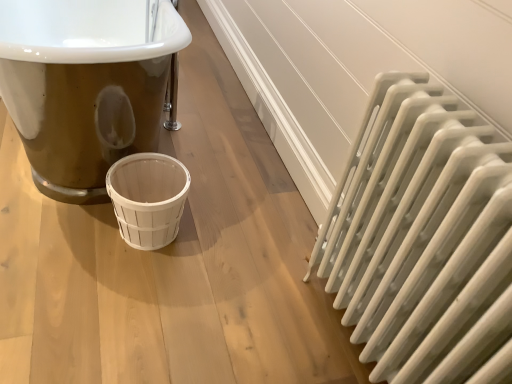
I want to click on free space in front of white wood basket at center, so click(x=128, y=286).